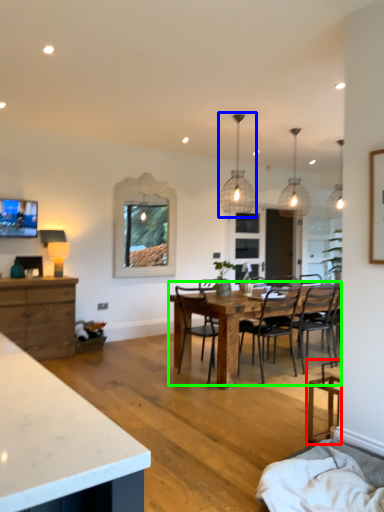
Question: Which object is positioned farthest from chair (highlighted by a red box)? Select from light fixture (highlighted by a blue box) and kitchen & dining room table (highlighted by a green box).

Choices:
 (A) light fixture
 (B) kitchen & dining room table

Answer: (A)